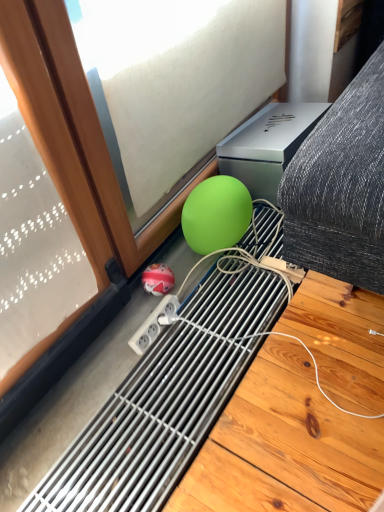
The image size is (384, 512). Find the location of `green matte ball at lower center, placed as the 1th ball when sorted from right to left`. green matte ball at lower center, placed as the 1th ball when sorted from right to left is located at coordinates 216,214.

What do you see at coordinates (158, 279) in the screenshot? I see `shiny red ball at lower center, positioned as the 1th ball in left-to-right order` at bounding box center [158, 279].

I want to click on green matte ball at lower center, which is counted as the 2th ball, starting from the bottom, so [216, 214].

Considering the relative positions of shiny red ball at lower center, the 2th ball from the right, and green matte sphere at lower center in the image provided, is shiny red ball at lower center, the 2th ball from the right, to the right of green matte sphere at lower center from the viewer's perspective?

No, shiny red ball at lower center, the 2th ball from the right, is not to the right of green matte sphere at lower center.

Identify the location of window positioned vertically above the shiny red ball at lower center, which ranks as the 1th ball in bottom-to-top order (from a real-world perspective). (174, 83).

Is shiny red ball at lower center, positioned as the 1th ball in left-to-right order, wider or thinner than green matte sphere at lower center?

Considering their sizes, shiny red ball at lower center, positioned as the 1th ball in left-to-right order, looks broader than green matte sphere at lower center.

Which of these two, shiny red ball at lower center, the 2th ball from the right, or green matte sphere at lower center, is smaller?

With smaller size is shiny red ball at lower center, the 2th ball from the right.

At what (x,y) coordinates should I click in order to perform the action: click on the 1st ball behind the green matte sphere at lower center. Please return your answer as a coordinate pair (x, y). This screenshot has height=512, width=384. Looking at the image, I should click on (216, 214).

Which is in front, point (155, 51) or point (233, 231)?

The point (155, 51) is closer.

Based on the photo, is green matte sphere at lower center oriented towards green matte ball at lower center, which appears as the 1th ball when viewed from the top?

Yes, green matte sphere at lower center is oriented towards green matte ball at lower center, which appears as the 1th ball when viewed from the top.

Is green matte sphere at lower center situated inside green matte ball at lower center, which appears as the 1th ball when viewed from the top, or outside?

green matte sphere at lower center is not inside green matte ball at lower center, which appears as the 1th ball when viewed from the top, it's outside.

Which of these two, shiny red ball at lower center, the 2th ball from the right, or green matte ball at lower center, the 2th ball in the left-to-right sequence, stands shorter?

shiny red ball at lower center, the 2th ball from the right.

Is shiny red ball at lower center, the 2th ball from the right, not within green matte ball at lower center, which is counted as the 2th ball, starting from the bottom?

shiny red ball at lower center, the 2th ball from the right, lies outside green matte ball at lower center, which is counted as the 2th ball, starting from the bottom,'s area.

Is shiny red ball at lower center, which ranks as the 1th ball in bottom-to-top order, bigger or smaller than green matte ball at lower center, placed as the 1th ball when sorted from right to left?

Considering their sizes, shiny red ball at lower center, which ranks as the 1th ball in bottom-to-top order, takes up less space than green matte ball at lower center, placed as the 1th ball when sorted from right to left.

Considering the positions of point (208, 129) and point (163, 291), is point (208, 129) closer or farther from the camera than point (163, 291)?

Point (208, 129).

From the image's perspective, which one is positioned lower, green matte sphere at lower center or shiny red ball at lower center, positioned as the 1th ball in left-to-right order?

shiny red ball at lower center, positioned as the 1th ball in left-to-right order, from the image's perspective.

From a real-world perspective, who is located lower, green matte sphere at lower center or shiny red ball at lower center, positioned as the 1th ball in left-to-right order?

From a 3D spatial view, shiny red ball at lower center, positioned as the 1th ball in left-to-right order, is below.

Does green matte sphere at lower center come in front of shiny red ball at lower center, which appears as the second ball when viewed from the top?

Yes, the depth of green matte sphere at lower center is less than that of shiny red ball at lower center, which appears as the second ball when viewed from the top.

Does green matte ball at lower center, the 2th ball in the left-to-right sequence, turn towards green matte sphere at lower center?

No, green matte ball at lower center, the 2th ball in the left-to-right sequence, is not oriented towards green matte sphere at lower center.

Is green matte ball at lower center, the 2th ball in the left-to-right sequence, wider or thinner than green matte sphere at lower center?

Considering their sizes, green matte ball at lower center, the 2th ball in the left-to-right sequence, looks broader than green matte sphere at lower center.

In terms of height, does green matte ball at lower center, which appears as the 1th ball when viewed from the top, look taller or shorter compared to green matte sphere at lower center?

green matte ball at lower center, which appears as the 1th ball when viewed from the top, is shorter than green matte sphere at lower center.

Considering the sizes of objects green matte ball at lower center, the 2th ball in the left-to-right sequence, and shiny red ball at lower center, the 2th ball from the right, in the image provided, who is smaller, green matte ball at lower center, the 2th ball in the left-to-right sequence, or shiny red ball at lower center, the 2th ball from the right,?

shiny red ball at lower center, the 2th ball from the right.

Is green matte ball at lower center, which appears as the 1th ball when viewed from the top, surrounding shiny red ball at lower center, which ranks as the 1th ball in bottom-to-top order?

No, shiny red ball at lower center, which ranks as the 1th ball in bottom-to-top order, is located outside of green matte ball at lower center, which appears as the 1th ball when viewed from the top.

In the scene shown: Would you consider green matte ball at lower center, which is counted as the 2th ball, starting from the bottom, to be distant from shiny red ball at lower center, the 2th ball from the right?

That's not correct — green matte ball at lower center, which is counted as the 2th ball, starting from the bottom, is a little close to shiny red ball at lower center, the 2th ball from the right.

Is green matte ball at lower center, the 2th ball in the left-to-right sequence, behind shiny red ball at lower center, positioned as the 1th ball in left-to-right order?

No, the depth of green matte ball at lower center, the 2th ball in the left-to-right sequence, is less than that of shiny red ball at lower center, positioned as the 1th ball in left-to-right order.

Find the location of a particular element. The width and height of the screenshot is (384, 512). window located on the right of shiny red ball at lower center, which appears as the second ball when viewed from the top is located at coordinates (174, 83).

The width and height of the screenshot is (384, 512). Find the location of `window located in front of the green matte ball at lower center, which appears as the 1th ball when viewed from the top`. window located in front of the green matte ball at lower center, which appears as the 1th ball when viewed from the top is located at coordinates [174, 83].

When comparing their distances from green matte ball at lower center, placed as the 1th ball when sorted from right to left, does shiny red ball at lower center, which appears as the second ball when viewed from the top, or green matte sphere at lower center seem closer?

Based on the image, shiny red ball at lower center, which appears as the second ball when viewed from the top, appears to be nearer to green matte ball at lower center, placed as the 1th ball when sorted from right to left.

Which object lies further to the anchor point green matte ball at lower center, placed as the 1th ball when sorted from right to left, green matte sphere at lower center or shiny red ball at lower center, positioned as the 1th ball in left-to-right order?

green matte sphere at lower center.

From the image, which object appears to be nearer to shiny red ball at lower center, which ranks as the 1th ball in bottom-to-top order, green matte ball at lower center, placed as the 1th ball when sorted from right to left, or green matte sphere at lower center?

green matte ball at lower center, placed as the 1th ball when sorted from right to left, is positioned closer to the anchor shiny red ball at lower center, which ranks as the 1th ball in bottom-to-top order.

Based on their spatial positions, is shiny red ball at lower center, the 2th ball from the right, or green matte ball at lower center, placed as the 1th ball when sorted from right to left, closer to green matte sphere at lower center?

green matte ball at lower center, placed as the 1th ball when sorted from right to left, is positioned closer to the anchor green matte sphere at lower center.

Estimate the real-world distances between objects in this image. Which object is closer to shiny red ball at lower center, positioned as the 1th ball in left-to-right order, green matte sphere at lower center or green matte ball at lower center, which is counted as the 2th ball, starting from the bottom?

green matte ball at lower center, which is counted as the 2th ball, starting from the bottom, is positioned closer to the anchor shiny red ball at lower center, positioned as the 1th ball in left-to-right order.

Based on their spatial positions, is green matte ball at lower center, placed as the 1th ball when sorted from right to left, or shiny red ball at lower center, the 2th ball from the right, further from green matte sphere at lower center?

Among the two, shiny red ball at lower center, the 2th ball from the right, is located further to green matte sphere at lower center.

This screenshot has width=384, height=512. I want to click on ball between green matte sphere at lower center and shiny red ball at lower center, the 2th ball from the right, in the vertical direction, so click(x=216, y=214).